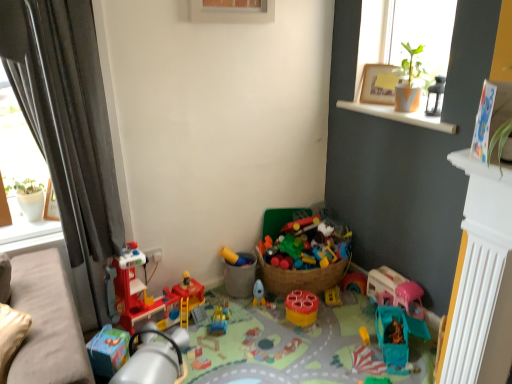
This screenshot has height=384, width=512. What are the coordinates of `blank space to the left of translucent plastic slide at center, which is the second toy from left to right` in the screenshot? It's located at (204, 322).